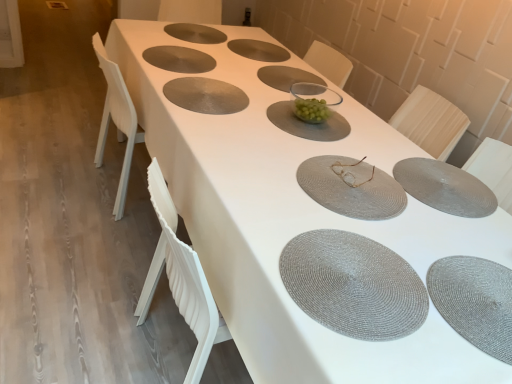
Image resolution: width=512 pixels, height=384 pixels. Find the location of `free spot to the right of matte gray placemat at center, which is counted as the third tableware, starting from the bottom`. free spot to the right of matte gray placemat at center, which is counted as the third tableware, starting from the bottom is located at coordinates (440, 198).